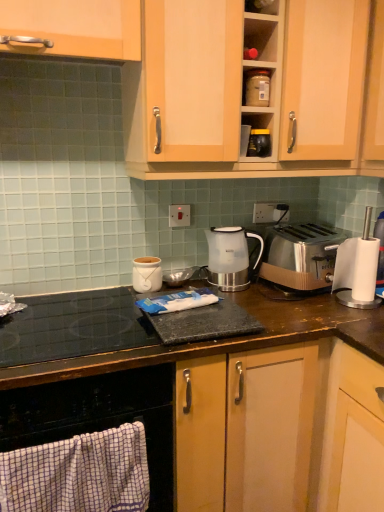
Question: Should I look upward or downward to see wooden cabinet at upper center, which ranks as the 1th cabinetry in right-to-left order?

Choices:
 (A) up
 (B) down

Answer: (A)

Question: Does brown wood countertop at center have a larger size compared to wooden cabinet handle at upper left, acting as the 2th cabinetry starting from the right?

Choices:
 (A) yes
 (B) no

Answer: (A)

Question: Does brown wood countertop at center have a smaller size compared to wooden cabinet handle at upper left, acting as the 2th cabinetry starting from the right?

Choices:
 (A) yes
 (B) no

Answer: (B)

Question: Is brown wood countertop at center not within wooden cabinet handle at upper left, acting as the 2th cabinetry starting from the right?

Choices:
 (A) no
 (B) yes

Answer: (B)

Question: Considering the relative positions of brown wood countertop at center and wooden cabinet handle at upper left, acting as the 1th cabinetry starting from the left, in the image provided, is brown wood countertop at center to the left of wooden cabinet handle at upper left, acting as the 1th cabinetry starting from the left, from the viewer's perspective?

Choices:
 (A) no
 (B) yes

Answer: (A)

Question: Is the position of brown wood countertop at center less distant than that of wooden cabinet handle at upper left, acting as the 1th cabinetry starting from the left?

Choices:
 (A) no
 (B) yes

Answer: (B)

Question: Does brown wood countertop at center have a greater height compared to wooden cabinet handle at upper left, acting as the 1th cabinetry starting from the left?

Choices:
 (A) no
 (B) yes

Answer: (B)

Question: Can you confirm if white plastic electric outlet at center, placed as the second electric outlet when sorted from back to front, is smaller than wooden cabinet handle at upper left, acting as the 1th cabinetry starting from the left?

Choices:
 (A) yes
 (B) no

Answer: (A)

Question: Is wooden cabinet handle at upper left, acting as the 2th cabinetry starting from the right, located within white plastic electric outlet at center, positioned as the 1th electric outlet in front-to-back order?

Choices:
 (A) no
 (B) yes

Answer: (A)

Question: Does white plastic electric outlet at center, positioned as the 1th electric outlet in front-to-back order, have a greater height compared to wooden cabinet handle at upper left, acting as the 2th cabinetry starting from the right?

Choices:
 (A) yes
 (B) no

Answer: (B)

Question: Are white plastic electric outlet at center, which is the 1th electric outlet in left-to-right order, and wooden cabinet handle at upper left, acting as the 1th cabinetry starting from the left, located far from each other?

Choices:
 (A) yes
 (B) no

Answer: (B)

Question: From a real-world perspective, is white plastic electric outlet at center, which is the 1th electric outlet in left-to-right order, beneath wooden cabinet handle at upper left, acting as the 1th cabinetry starting from the left?

Choices:
 (A) yes
 (B) no

Answer: (A)

Question: Is white plastic electric outlet at center, which is the 1th electric outlet in left-to-right order, oriented away from wooden cabinet handle at upper left, acting as the 2th cabinetry starting from the right?

Choices:
 (A) yes
 (B) no

Answer: (B)

Question: From the image's perspective, is wooden cabinet handle at upper left, acting as the 2th cabinetry starting from the right, beneath satin silver outlet at center, acting as the 1th electric outlet starting from the back?

Choices:
 (A) no
 (B) yes

Answer: (A)